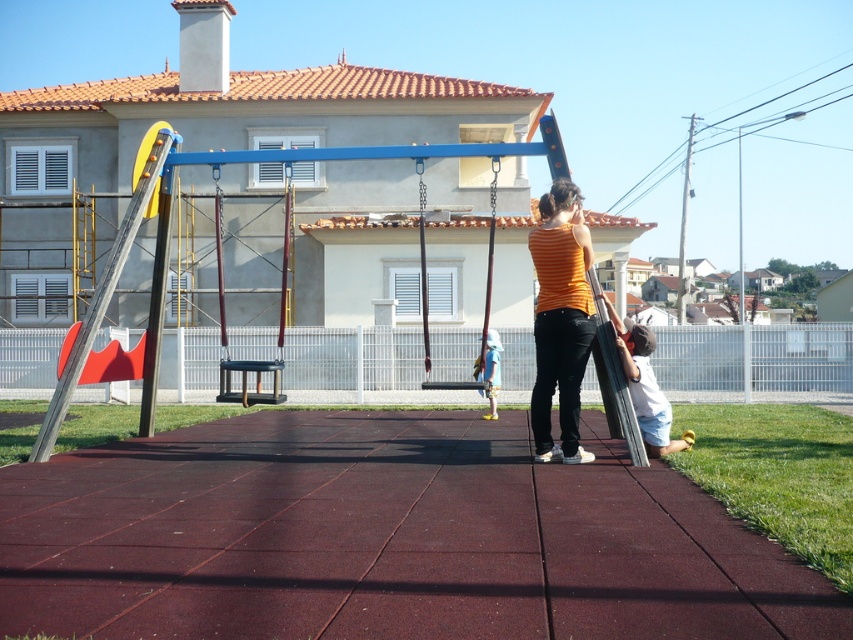
Can you confirm if orange matte tank top at center is positioned to the left of brown leather swing at center?

In fact, orange matte tank top at center is to the right of brown leather swing at center.

Which is in front, point (558, 388) or point (427, 336)?

Point (558, 388)

In order to click on orange matte tank top at center in this screenshot , I will do `click(560, 320)`.

Which is below, burgundy rubber mat at center or light blue denim shorts at center?

Positioned lower is burgundy rubber mat at center.

Which is above, burgundy rubber mat at center or light blue denim shorts at center?

light blue denim shorts at center is above.

Where is `burgundy rubber mat at center`? This screenshot has width=853, height=640. burgundy rubber mat at center is located at coordinates (386, 538).

Between burgundy rubber mat at center and orange matte tank top at center, which one has less height?

With less height is burgundy rubber mat at center.

Who is positioned more to the right, burgundy rubber mat at center or orange matte tank top at center?

orange matte tank top at center is more to the right.

The image size is (853, 640). Describe the element at coordinates (386, 538) in the screenshot. I see `burgundy rubber mat at center` at that location.

Image resolution: width=853 pixels, height=640 pixels. Find the location of `burgundy rubber mat at center`. burgundy rubber mat at center is located at coordinates (386, 538).